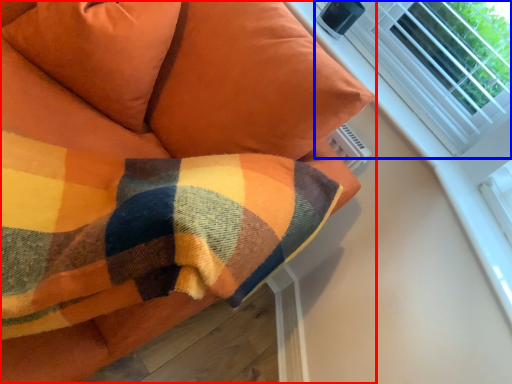
Question: Which point is further to the camera, furniture (highlighted by a red box) or bay window (highlighted by a blue box)?

Choices:
 (A) furniture
 (B) bay window

Answer: (B)